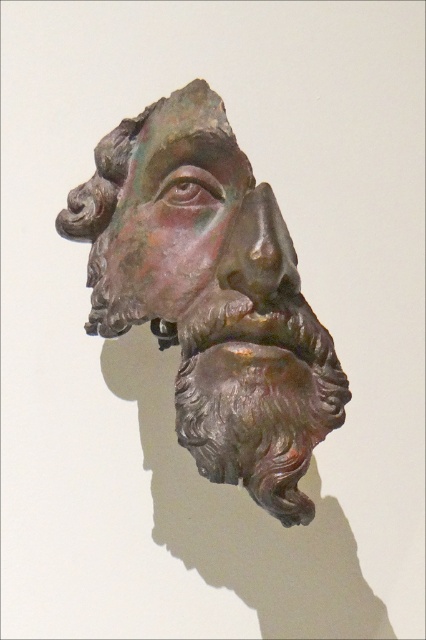
Does bronze head at center have a greater height compared to rusty bronze face at center?

Correct, bronze head at center is much taller as rusty bronze face at center.

Can you confirm if bronze head at center is bigger than rusty bronze face at center?

Yes.

Describe the element at coordinates (210, 294) in the screenshot. I see `bronze head at center` at that location.

This screenshot has width=426, height=640. In order to click on bronze head at center in this screenshot , I will do `click(210, 294)`.